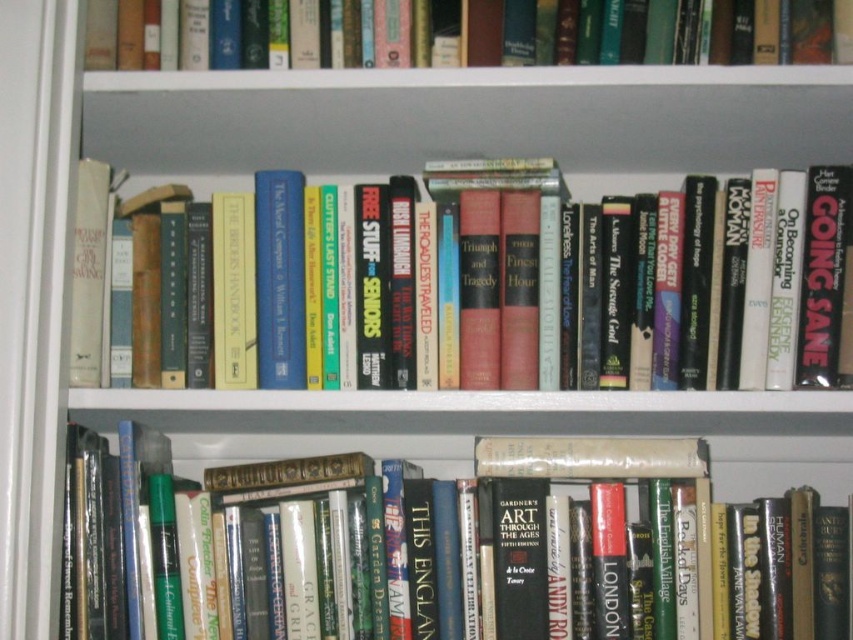
Can you confirm if hardcover book at center is positioned to the left of hardcover book at upper center?

Incorrect, hardcover book at center is not on the left side of hardcover book at upper center.

Can you confirm if hardcover book at center is positioned below hardcover book at upper center?

Yes, hardcover book at center is below hardcover book at upper center.

Who is more distant from viewer, (622, 268) or (560, 28)?

The point (560, 28) is behind.

Identify the location of hardcover book at center. 724,282.

Which is behind, point (276, 614) or point (787, 38)?

The point (276, 614) is more distant.

Between hardcover book at lower center and hardcover book at upper center, which one is positioned lower?

hardcover book at lower center is lower down.

Locate an element on the screen. hardcover book at lower center is located at coordinates (531, 545).

Can you confirm if hardcover book at center is positioned below hardcover book at lower center?

No, hardcover book at center is not below hardcover book at lower center.

Which is above, hardcover book at center or hardcover book at lower center?

Positioned higher is hardcover book at center.

Who is more distant from viewer, (230, 211) or (74, 456)?

Positioned behind is point (230, 211).

Where is `hardcover book at center`? The height and width of the screenshot is (640, 853). hardcover book at center is located at coordinates (724, 282).